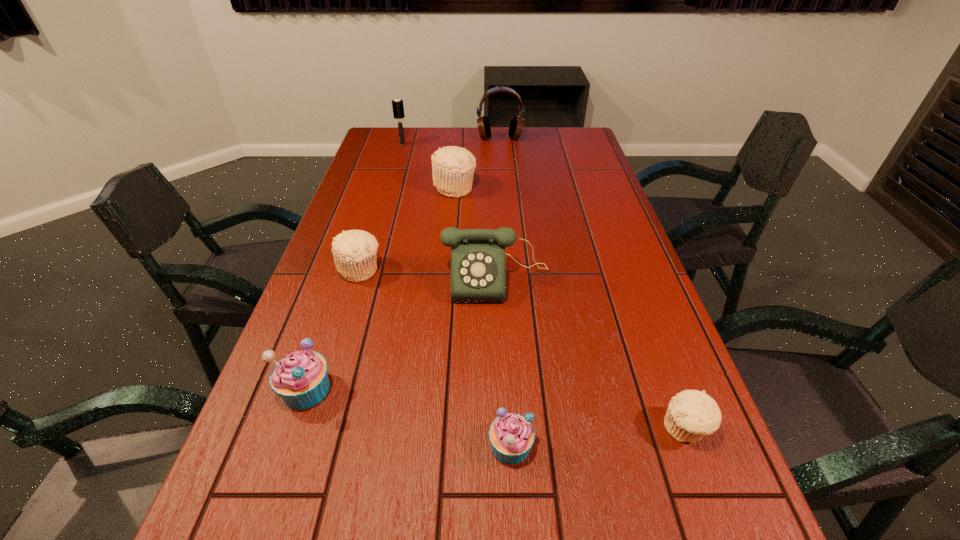
Where is `headset`? Image resolution: width=960 pixels, height=540 pixels. headset is located at coordinates (516, 126).

Locate an element on the screen. This screenshot has height=540, width=960. hairbrush is located at coordinates (398, 110).

At what (x,y) coordinates should I click in order to perform the action: click on the farthest beige muffin. Please return your answer as a coordinate pair (x, y). The width and height of the screenshot is (960, 540). Looking at the image, I should click on (453, 167).

Locate an element on the screen. This screenshot has width=960, height=540. the third farthest object is located at coordinates (453, 167).

The image size is (960, 540). I want to click on telephone, so click(x=478, y=261).

You are a GUI agent. You are given a task and a screenshot of the screen. Output one action in this format:
    pyautogui.click(x=<x>, y=<y>)
    Task: Click on the farther blue muffin
    The width and height of the screenshot is (960, 540).
    Given the screenshot: What is the action you would take?
    pyautogui.click(x=300, y=379)

Where is `the left blue muffin`? the left blue muffin is located at coordinates (300, 379).

Where is `the second farthest muffin`? The height and width of the screenshot is (540, 960). the second farthest muffin is located at coordinates point(354,251).

The image size is (960, 540). I want to click on the second smallest beige muffin, so click(x=354, y=251).

Image resolution: width=960 pixels, height=540 pixels. I want to click on the smaller blue muffin, so 511,435.